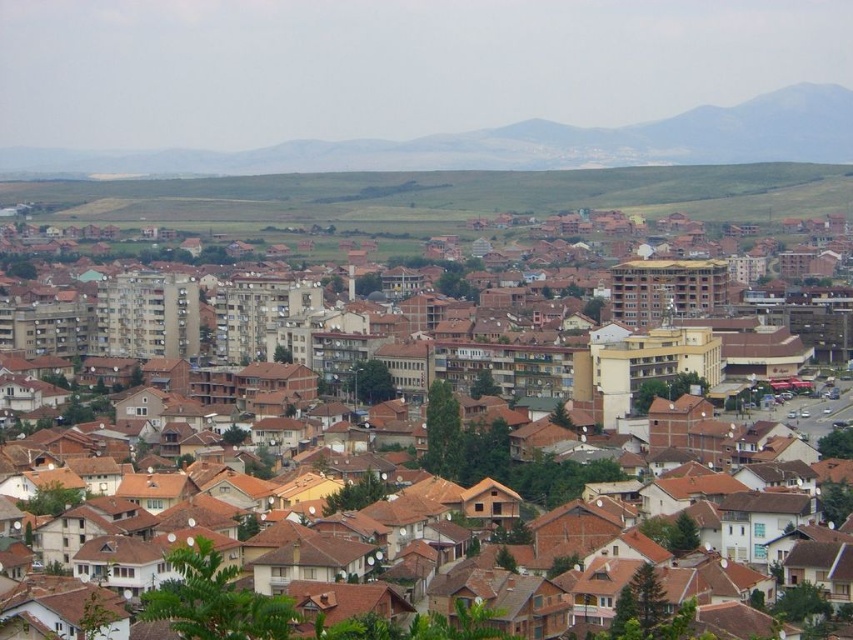
You are standing at the origin point of the coordinate system in this urban valley scene. You want to locate the brown brick buildings at center. What are their coordinates?

The brown brick buildings at center are located at coordinates point [457,404].